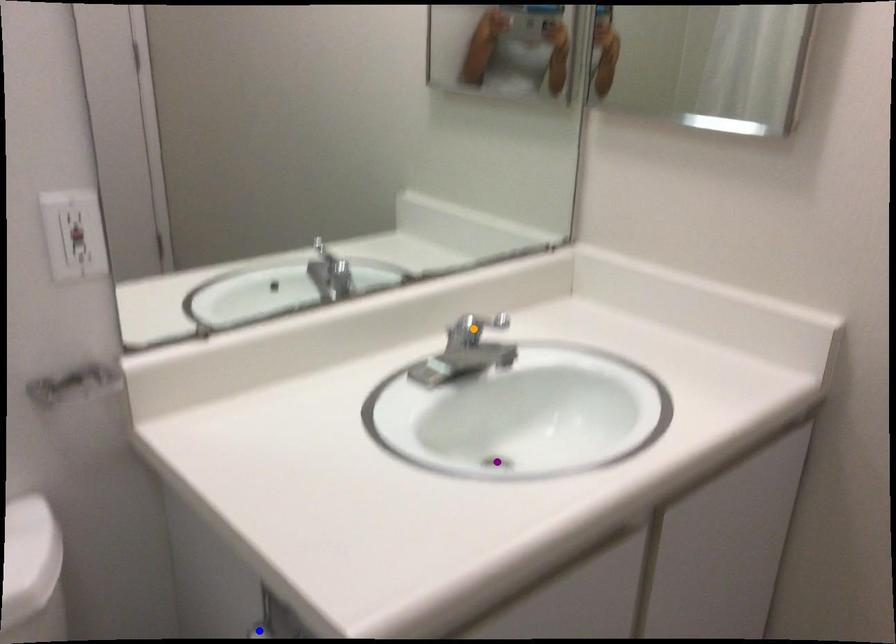
Order these from nearest to farthest:
purple point
blue point
orange point

blue point → purple point → orange point